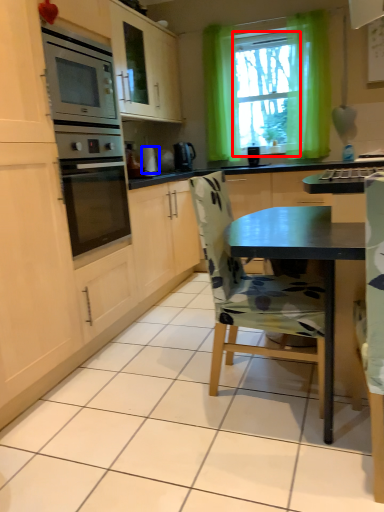
Question: Which object is further to the camera taking this photo, window screen (highlighted by a red box) or appliance (highlighted by a blue box)?

Choices:
 (A) window screen
 (B) appliance

Answer: (B)